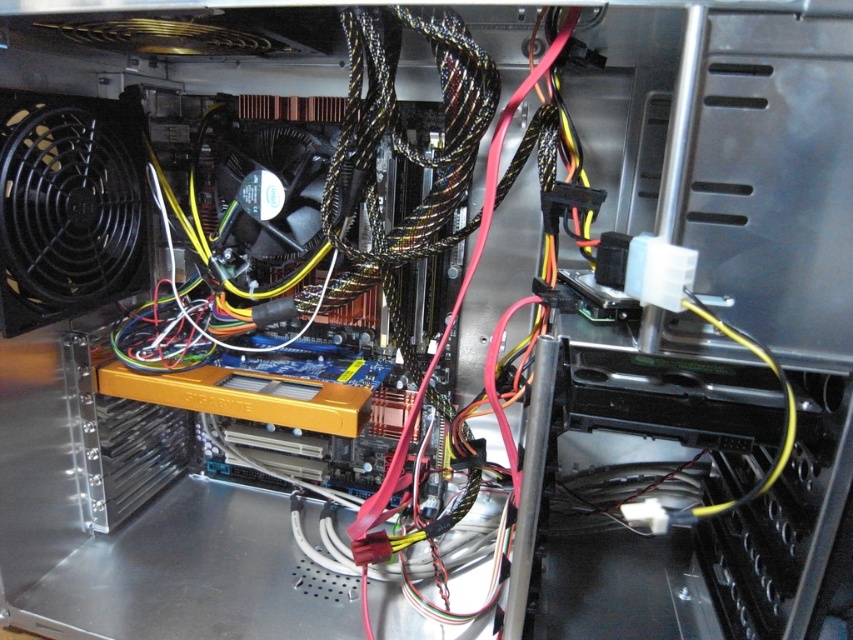
The image size is (853, 640). Describe the element at coordinates (67, 209) in the screenshot. I see `black plastic fan at left` at that location.

Is point (54, 205) farther from camera compared to point (310, 252)?

No.

Locate an element on the screen. The width and height of the screenshot is (853, 640). black plastic fan at left is located at coordinates tap(67, 209).